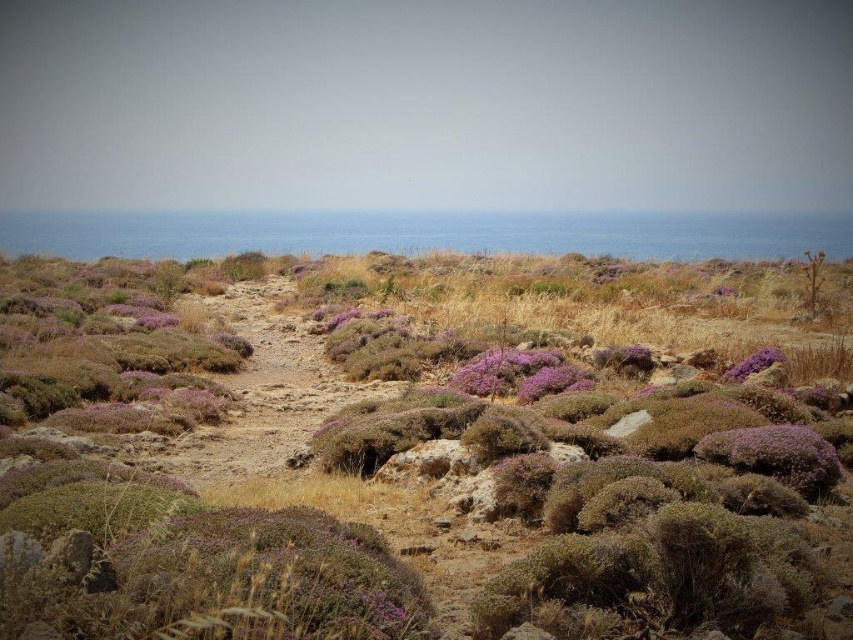
You are a hiker who wants to take a photo of both the purple shrubbery at center and the purple fuzzy bush at center. Since you want both to be in focus, you need to know which one is taller. Can you tell me which one is taller?

The purple shrubbery at center is much taller than the purple fuzzy bush at center, so you should focus on the purple shrubbery at center first to ensure both are in focus.